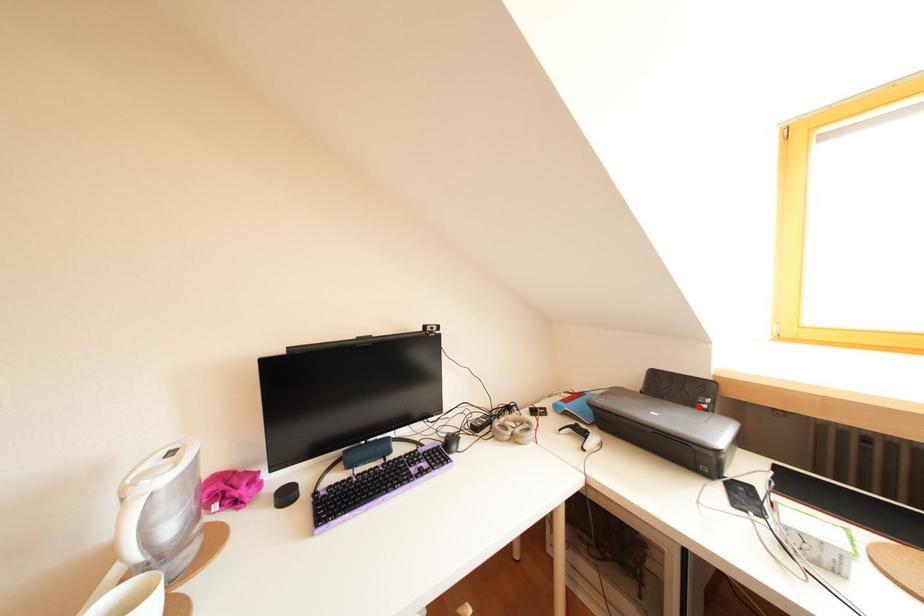
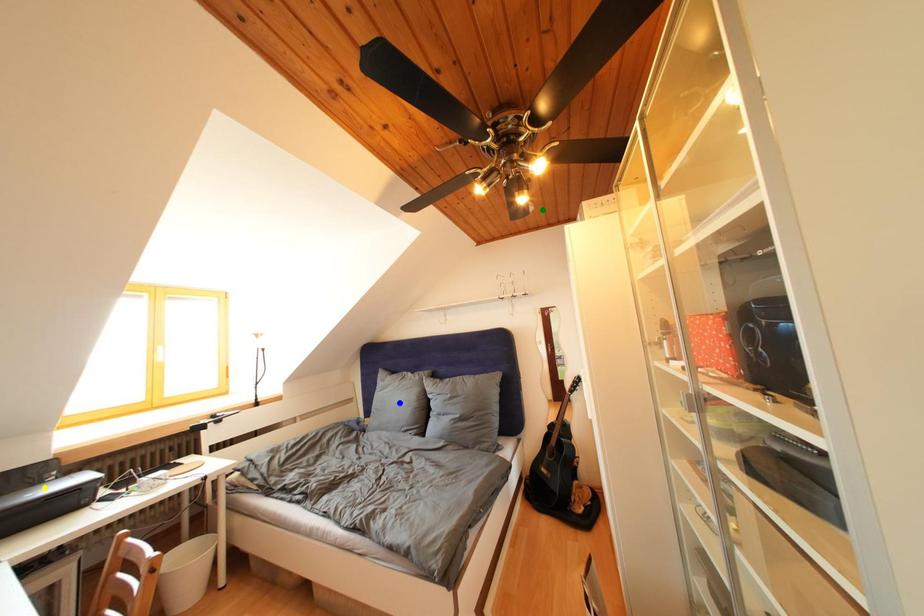
Question: I am providing you with two images of the same scene from different viewpoints. A red point is marked on the first image. You are given multiple points on the second image. Which spot in image 2 lines up with the point in image 1?

Choices:
 (A) green point
 (B) yellow point
 (C) blue point

Answer: (B)